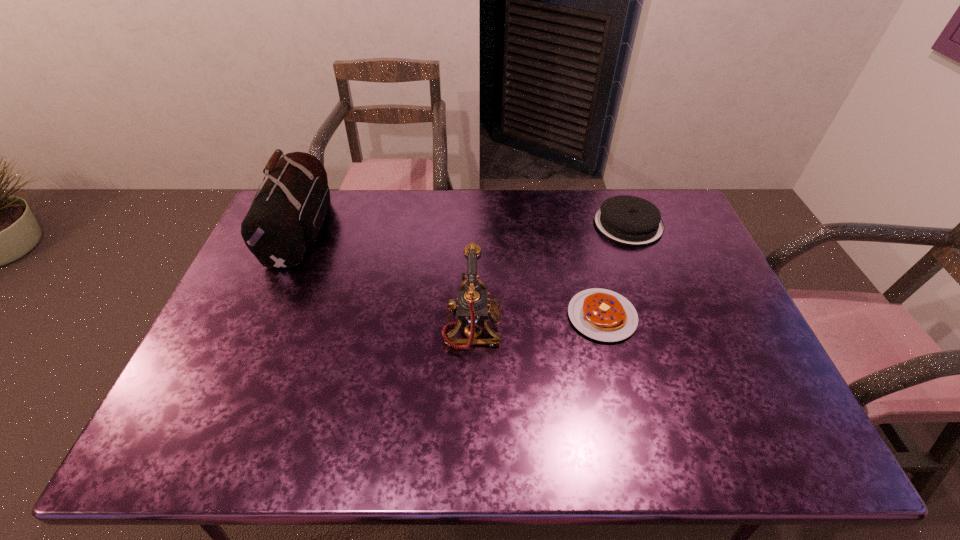
Where is `the leftmost object`? the leftmost object is located at coordinates click(285, 218).

I want to click on the third shortest object, so click(473, 307).

Identify the location of the third object from right to left. (473, 307).

You are a GUI agent. You are given a task and a screenshot of the screen. Output one action in this format:
    pyautogui.click(x=<x>, y=<y>)
    Task: Click on the farther pancake
    The image size is (960, 540).
    Given the screenshot: What is the action you would take?
    pyautogui.click(x=628, y=220)

You are a GUI agent. You are given a task and a screenshot of the screen. Output one action in this format:
    pyautogui.click(x=<x>, y=<y>)
    Task: Click on the taller pancake
    The height and width of the screenshot is (540, 960).
    Given the screenshot: What is the action you would take?
    pyautogui.click(x=628, y=220)

Identify the location of the shortest object. Image resolution: width=960 pixels, height=540 pixels. (601, 314).

Locate an element on the screen. Image resolution: width=960 pixels, height=540 pixels. the nearer pancake is located at coordinates (601, 314).

Where is `vacant space positioned on the front pocket of the duffel bag`? vacant space positioned on the front pocket of the duffel bag is located at coordinates (355, 230).

Where is `vacant space located on the front of the third shortest object, featuring the rotary dial`? The image size is (960, 540). vacant space located on the front of the third shortest object, featuring the rotary dial is located at coordinates (600, 328).

Where is `free space located 0.060m on the right of the third tallest object`? free space located 0.060m on the right of the third tallest object is located at coordinates (680, 224).